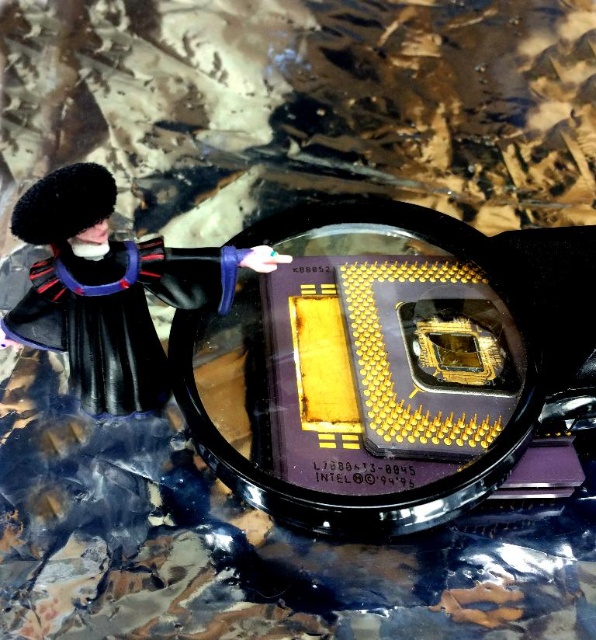
You are a detective examining a crime scene miniature. You see a black plastic magnifying glass at center and a black matte toy at left. Which object is positioned to the right of the other?

The black plastic magnifying glass at center is to the right of the black matte toy at left.

You are a photographer adjusting the focus on a camera. You notice two points in the frame at coordinates point (263, 435) and point (38, 204). Which point should you focus on first if you want to ensure the closest object is in focus?

You should focus on point (38, 204) first because it is closer to the camera than point (263, 435), ensuring the closest object is in focus.